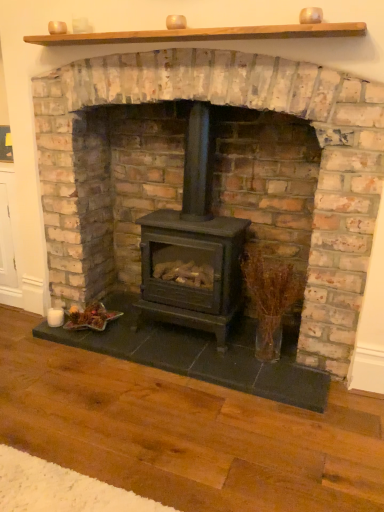
Question: From the image's perspective, is black matte wood stove at center beneath translucent glass vase at right?

Choices:
 (A) no
 (B) yes

Answer: (A)

Question: Considering the relative sizes of black matte wood stove at center and translucent glass vase at right in the image provided, is black matte wood stove at center thinner than translucent glass vase at right?

Choices:
 (A) no
 (B) yes

Answer: (A)

Question: Considering the relative sizes of black matte wood stove at center and translucent glass vase at right in the image provided, is black matte wood stove at center shorter than translucent glass vase at right?

Choices:
 (A) no
 (B) yes

Answer: (A)

Question: Does black matte wood stove at center turn towards translucent glass vase at right?

Choices:
 (A) yes
 (B) no

Answer: (A)

Question: From a real-world perspective, is black matte wood stove at center below translucent glass vase at right?

Choices:
 (A) no
 (B) yes

Answer: (A)

Question: Can translucent glass vase at right be found inside black matte wood stove at center?

Choices:
 (A) yes
 (B) no

Answer: (A)

Question: Does black matte wood burning stove at center have a greater width compared to black matte wood stove at center?

Choices:
 (A) yes
 (B) no

Answer: (B)

Question: From a real-world perspective, is black matte wood burning stove at center located beneath black matte wood stove at center?

Choices:
 (A) no
 (B) yes

Answer: (B)

Question: Is black matte wood burning stove at center positioned before black matte wood stove at center?

Choices:
 (A) no
 (B) yes

Answer: (A)

Question: Is black matte wood burning stove at center at the right side of black matte wood stove at center?

Choices:
 (A) no
 (B) yes

Answer: (A)

Question: Does black matte wood burning stove at center have a lesser height compared to black matte wood stove at center?

Choices:
 (A) yes
 (B) no

Answer: (A)

Question: Can you confirm if black matte wood burning stove at center is thinner than black matte wood stove at center?

Choices:
 (A) yes
 (B) no

Answer: (A)

Question: Is black matte wood stove at center at the right side of black matte wood burning stove at center?

Choices:
 (A) no
 (B) yes

Answer: (B)